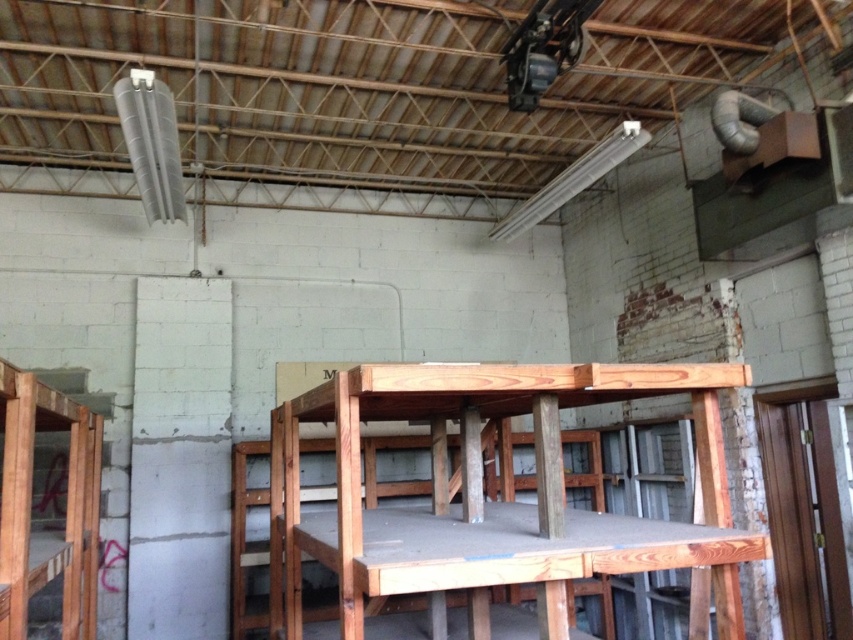
You are standing in the warehouse and see the point marked at coordinates (492, 500). What object is located at that point?

The point at coordinates (492, 500) corresponds to the natural wood table at center.

You are moving a 4.5 feet long sofa into this industrial space. You want to place it between the natural wood table at center and the wooden bunk bed at left. Is there enough space for the sofa to fit in that area?

The natural wood table at center is 4.55 feet from the wooden bunk bed at left. Since the sofa is 4.5 feet long, there is just enough space for it to fit between them.